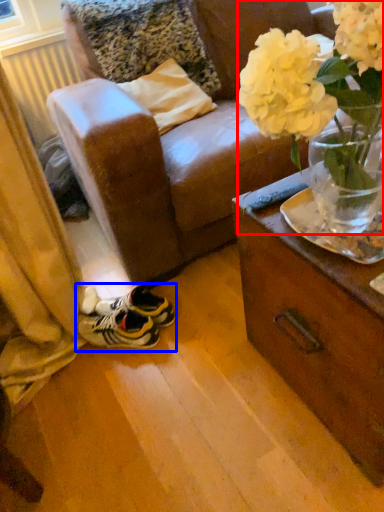
Question: Which object is further to the camera taking this photo, floral arrangement (highlighted by a red box) or footwear (highlighted by a blue box)?

Choices:
 (A) floral arrangement
 (B) footwear

Answer: (B)